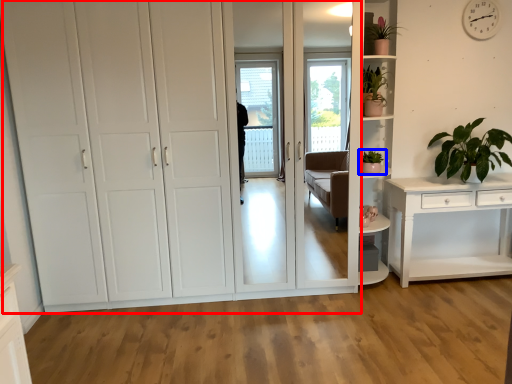
Question: Which object is closer to the camera taking this photo, cupboard (highlighted by a red box) or houseplant (highlighted by a blue box)?

Choices:
 (A) cupboard
 (B) houseplant

Answer: (A)